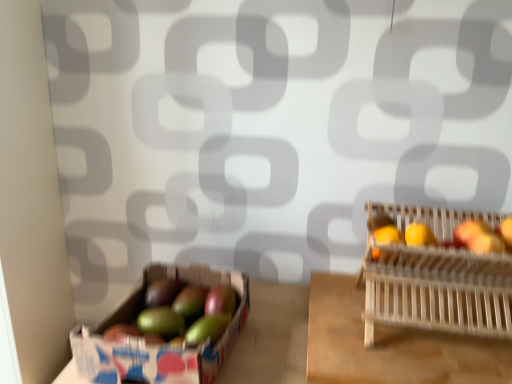
Question: Does wooden slatted basket at right have a greater height compared to green matte apple at center, which is the 3th apple from right to left?

Choices:
 (A) no
 (B) yes

Answer: (B)

Question: Is wooden slatted basket at right aimed at green matte apple at center, arranged as the third apple when viewed from the left?

Choices:
 (A) yes
 (B) no

Answer: (B)

Question: Can you confirm if wooden slatted basket at right is positioned to the right of green matte apple at center, which is the 3th apple from right to left?

Choices:
 (A) no
 (B) yes

Answer: (B)

Question: Can we say wooden slatted basket at right lies outside green matte apple at center, which is the 3th apple from right to left?

Choices:
 (A) no
 (B) yes

Answer: (B)

Question: From a real-world perspective, is wooden slatted basket at right positioned under green matte apple at center, which is the 3th apple from right to left, based on gravity?

Choices:
 (A) no
 (B) yes

Answer: (A)

Question: From their relative heights in the image, would you say green matte mangoes at left is taller or shorter than shiny red apple at right, the fifth apple viewed from the left?

Choices:
 (A) short
 (B) tall

Answer: (B)

Question: Looking at the image, does green matte mangoes at left seem bigger or smaller compared to shiny red apple at right, placed as the first apple when sorted from right to left?

Choices:
 (A) big
 (B) small

Answer: (A)

Question: Is green matte mangoes at left inside the boundaries of shiny red apple at right, the fifth apple viewed from the left, or outside?

Choices:
 (A) inside
 (B) outside

Answer: (B)

Question: From a real-world perspective, is green matte mangoes at left physically located above or below shiny red apple at right, placed as the first apple when sorted from right to left?

Choices:
 (A) above
 (B) below

Answer: (B)

Question: Based on their positions, is green matte avocado at lower left, arranged as the 5th apple when viewed from the right, located to the left or right of shiny red apple at right, the fourth apple viewed from the left?

Choices:
 (A) left
 (B) right

Answer: (A)

Question: Is green matte avocado at lower left, arranged as the first apple when viewed from the left, situated inside shiny red apple at right, the fourth apple viewed from the left, or outside?

Choices:
 (A) outside
 (B) inside

Answer: (A)

Question: Looking at their shapes, would you say green matte avocado at lower left, arranged as the 5th apple when viewed from the right, is wider or thinner than shiny red apple at right, which is the 2th apple from right to left?

Choices:
 (A) wide
 (B) thin

Answer: (A)

Question: From the image's perspective, relative to shiny red apple at right, which is the 2th apple from right to left, is green matte avocado at lower left, arranged as the first apple when viewed from the left, above or below?

Choices:
 (A) above
 (B) below

Answer: (B)

Question: Considering the positions of wooden slatted basket at right and shiny red apple at right, which is the 2th apple from right to left, in the image, is wooden slatted basket at right bigger or smaller than shiny red apple at right, which is the 2th apple from right to left,?

Choices:
 (A) small
 (B) big

Answer: (B)

Question: Is point (371, 213) positioned closer to the camera than point (493, 241)?

Choices:
 (A) farther
 (B) closer

Answer: (A)